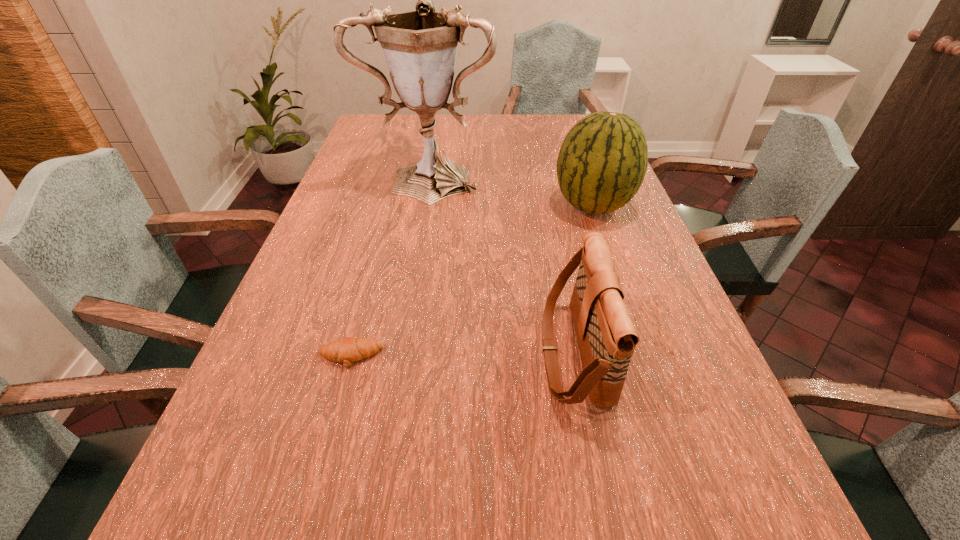
Locate an element on the screen. Image resolution: width=960 pixels, height=540 pixels. trophy cup present at the left edge is located at coordinates (420, 47).

Find the location of a particular element. The height and width of the screenshot is (540, 960). crescent roll that is at the left edge is located at coordinates (349, 349).

Find the location of `object located at the right edge`. object located at the right edge is located at coordinates (602, 162).

At what (x,y) coordinates should I click in order to perform the action: click on vacant space at the far edge of the desktop. Please return your answer as a coordinate pair (x, y). This screenshot has width=960, height=540. Looking at the image, I should click on (542, 136).

The width and height of the screenshot is (960, 540). Identify the location of free point at the left edge. (272, 373).

This screenshot has width=960, height=540. In the image, there is a desktop. Identify the location of free space at the right edge. (642, 240).

You are a GUI agent. You are given a task and a screenshot of the screen. Output one action in this format:
    pyautogui.click(x=<x>, y=<y>)
    Task: Click on the free point between the trophy cup and the crescent roll
    This screenshot has width=960, height=540.
    Given the screenshot: What is the action you would take?
    click(391, 266)

Where is `free spot between the second tallest object and the tallest object`? The height and width of the screenshot is (540, 960). free spot between the second tallest object and the tallest object is located at coordinates (513, 191).

Find the location of a particular element. free space between the trophy cup and the third shortest object is located at coordinates (513, 191).

Locate an element on the screen. Image resolution: width=960 pixels, height=540 pixels. free space between the watermelon and the tallest object is located at coordinates (513, 191).